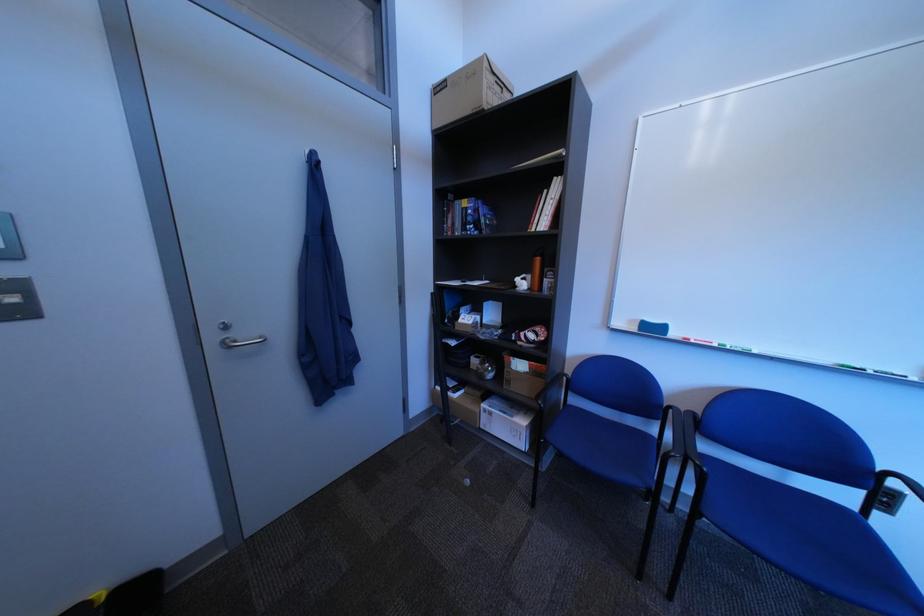
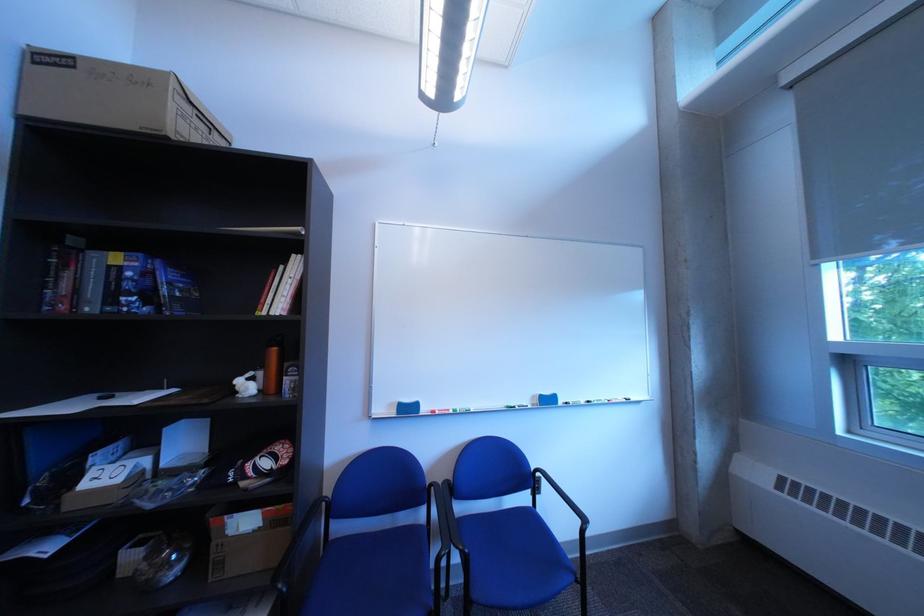
Where in the second image is the point corresponding to point (721, 471) from the first image?

(482, 553)